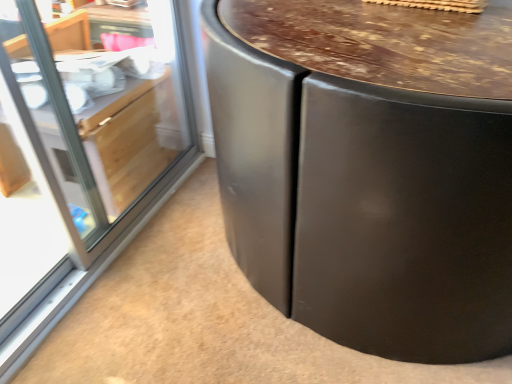
Describe the element at coordinates (91, 135) in the screenshot. I see `transparent glass screen door at left` at that location.

At what (x,y) coordinates should I click in order to perform the action: click on transparent glass screen door at left. Please return your answer as a coordinate pair (x, y). Looking at the image, I should click on (91, 135).

The width and height of the screenshot is (512, 384). What are the coordinates of `transparent glass screen door at left` in the screenshot? It's located at (91, 135).